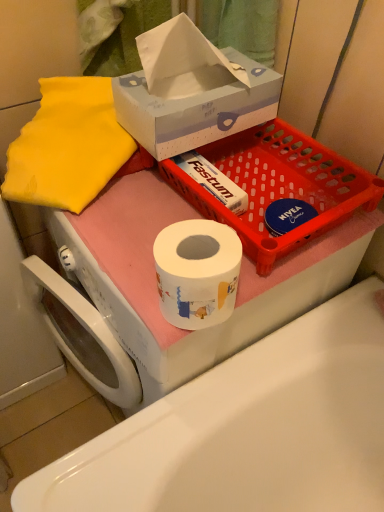
Question: Is white glossy toilet paper at center smaller than matte plastic basket at upper center?

Choices:
 (A) yes
 (B) no

Answer: (B)

Question: Considering the relative positions of white glossy toilet paper at center and matte plastic basket at upper center in the image provided, is white glossy toilet paper at center to the right of matte plastic basket at upper center from the viewer's perspective?

Choices:
 (A) yes
 (B) no

Answer: (B)

Question: Is white glossy toilet paper at center with matte plastic basket at upper center?

Choices:
 (A) yes
 (B) no

Answer: (B)

Question: Is white glossy toilet paper at center not near matte plastic basket at upper center?

Choices:
 (A) no
 (B) yes

Answer: (A)

Question: Is white glossy toilet paper at center positioned with its back to matte plastic basket at upper center?

Choices:
 (A) yes
 (B) no

Answer: (B)

Question: Does white glossy toilet paper at center lie behind matte plastic basket at upper center?

Choices:
 (A) yes
 (B) no

Answer: (B)

Question: Can you confirm if white cardboard tissue box at upper center is positioned to the left of matte plastic basket at upper center?

Choices:
 (A) no
 (B) yes

Answer: (B)

Question: Is white cardboard tissue box at upper center closer to the viewer compared to matte plastic basket at upper center?

Choices:
 (A) yes
 (B) no

Answer: (A)

Question: From the image's perspective, does white cardboard tissue box at upper center appear lower than matte plastic basket at upper center?

Choices:
 (A) no
 (B) yes

Answer: (A)

Question: Is matte plastic basket at upper center completely or partially inside white cardboard tissue box at upper center?

Choices:
 (A) yes
 (B) no

Answer: (B)

Question: Considering the relative positions of white cardboard tissue box at upper center and matte plastic basket at upper center in the image provided, is white cardboard tissue box at upper center behind matte plastic basket at upper center?

Choices:
 (A) yes
 (B) no

Answer: (B)

Question: Can you confirm if white cardboard tissue box at upper center is shorter than matte plastic basket at upper center?

Choices:
 (A) yes
 (B) no

Answer: (B)

Question: Is matte plastic basket at upper center aimed at white cardboard tissue box at upper center?

Choices:
 (A) no
 (B) yes

Answer: (A)